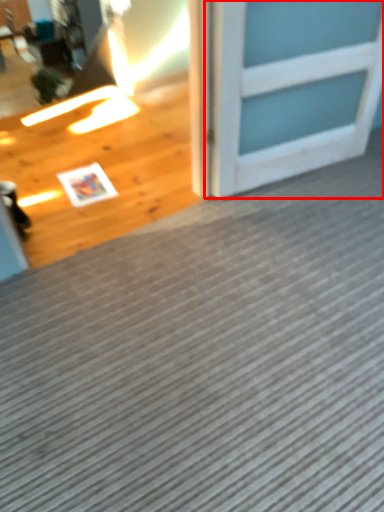
Question: From the image's perspective, where is door (annotated by the red box) located relative to doormat?

Choices:
 (A) below
 (B) above

Answer: (B)